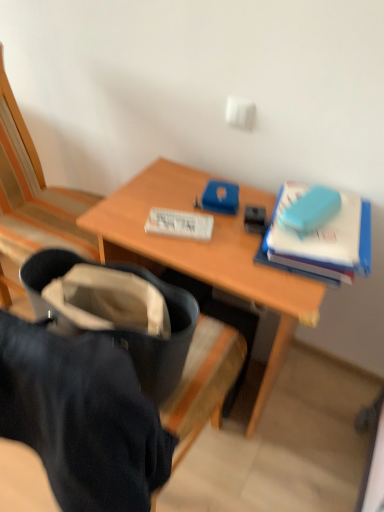
Measure the distance between black fabric bag at center and camera.

black fabric bag at center and camera are 20.09 inches apart from each other.

The height and width of the screenshot is (512, 384). What do you see at coordinates (82, 418) in the screenshot?
I see `black fabric bag at center` at bounding box center [82, 418].

Describe the element at coordinates (180, 224) in the screenshot. This screenshot has width=384, height=512. I see `white paper at center, placed as the first paperback book when sorted from left to right` at that location.

How much space does blue matte book at upper right, arranged as the second paperback book when viewed from the left, occupy vertically?

2.57 inches.

This screenshot has width=384, height=512. What do you see at coordinates (34, 193) in the screenshot?
I see `wooden chair at left` at bounding box center [34, 193].

Locate an element on the screen. black fabric bag at center is located at coordinates (82, 418).

From the image's perspective, which is above, wooden chair at left or black fabric bag at center?

wooden chair at left, from the image's perspective.

Considering the relative sizes of wooden chair at left and black fabric bag at center in the image provided, is wooden chair at left bigger than black fabric bag at center?

Yes, wooden chair at left is bigger than black fabric bag at center.

Who is taller, wooden chair at left or black fabric bag at center?

With more height is wooden chair at left.

Considering the sizes of objects wooden chair at left and black fabric bag at center in the image provided, who is wider, wooden chair at left or black fabric bag at center?

Wider between the two is wooden chair at left.

Is wooden chair at left far away from white paper at center, which appears as the second paperback book when viewed from the right?

No, wooden chair at left is not far from white paper at center, which appears as the second paperback book when viewed from the right.

Is wooden chair at left further to camera compared to white paper at center, which appears as the second paperback book when viewed from the right?

No, wooden chair at left is closer to the viewer.

Who is smaller, wooden chair at left or white paper at center, placed as the first paperback book when sorted from left to right?

white paper at center, placed as the first paperback book when sorted from left to right, is smaller.

Looking at this image, how many degrees apart are the facing directions of wooden chair at left and white paper at center, which appears as the second paperback book when viewed from the right?

There is a 20.1-degree angle between the facing directions of wooden chair at left and white paper at center, which appears as the second paperback book when viewed from the right.

Considering the sizes of white paper at center, which appears as the second paperback book when viewed from the right, and blue matte book at upper right, the 1th paperback book in the right-to-left sequence, in the image, is white paper at center, which appears as the second paperback book when viewed from the right, wider or thinner than blue matte book at upper right, the 1th paperback book in the right-to-left sequence,?

Clearly, white paper at center, which appears as the second paperback book when viewed from the right, has less width compared to blue matte book at upper right, the 1th paperback book in the right-to-left sequence.

This screenshot has height=512, width=384. What are the coordinates of `paperback book above the blue matte book at upper right, arranged as the second paperback book when viewed from the left (from the image's perspective)` in the screenshot? It's located at (180, 224).

From a real-world perspective, between white paper at center, which appears as the second paperback book when viewed from the right, and blue matte book at upper right, arranged as the second paperback book when viewed from the left, who is vertically lower?

From a 3D spatial view, white paper at center, which appears as the second paperback book when viewed from the right, is below.

From the picture: Considering the relative sizes of white paper at center, which appears as the second paperback book when viewed from the right, and black fabric bag at center in the image provided, is white paper at center, which appears as the second paperback book when viewed from the right, wider than black fabric bag at center?

No, white paper at center, which appears as the second paperback book when viewed from the right, is not wider than black fabric bag at center.

Considering the relative positions of white paper at center, which appears as the second paperback book when viewed from the right, and black fabric bag at center in the image provided, is white paper at center, which appears as the second paperback book when viewed from the right, to the left of black fabric bag at center from the viewer's perspective?

No, white paper at center, which appears as the second paperback book when viewed from the right, is not to the left of black fabric bag at center.

Which object is further away from the camera, white paper at center, which appears as the second paperback book when viewed from the right, or black fabric bag at center?

white paper at center, which appears as the second paperback book when viewed from the right, is further away from the camera.

Can you see white paper at center, placed as the first paperback book when sorted from left to right, touching black fabric bag at center?

white paper at center, placed as the first paperback book when sorted from left to right, and black fabric bag at center are not in contact.

Relative to blue matte book at upper right, the 1th paperback book in the right-to-left sequence, is wooden chair at left in front or behind?

In the image, wooden chair at left appears in front of blue matte book at upper right, the 1th paperback book in the right-to-left sequence.

In terms of size, does wooden chair at left appear bigger or smaller than blue matte book at upper right, arranged as the second paperback book when viewed from the left?

Considering their sizes, wooden chair at left takes up more space than blue matte book at upper right, arranged as the second paperback book when viewed from the left.

Considering the positions of objects wooden chair at left and blue matte book at upper right, the 1th paperback book in the right-to-left sequence, in the image provided, who is more to the left, wooden chair at left or blue matte book at upper right, the 1th paperback book in the right-to-left sequence,?

Positioned to the left is wooden chair at left.

Considering the points (8, 89) and (327, 234), which point is in front, point (8, 89) or point (327, 234)?

The point (327, 234) is closer to the camera.

Which object is closer to the camera taking this photo, blue matte book at upper right, the 1th paperback book in the right-to-left sequence, or white paper at center, placed as the first paperback book when sorted from left to right?

blue matte book at upper right, the 1th paperback book in the right-to-left sequence.

Considering the relative sizes of blue matte book at upper right, arranged as the second paperback book when viewed from the left, and white paper at center, placed as the first paperback book when sorted from left to right, in the image provided, is blue matte book at upper right, arranged as the second paperback book when viewed from the left, wider than white paper at center, placed as the first paperback book when sorted from left to right,?

Correct, the width of blue matte book at upper right, arranged as the second paperback book when viewed from the left, exceeds that of white paper at center, placed as the first paperback book when sorted from left to right.

What's the angular difference between blue matte book at upper right, the 1th paperback book in the right-to-left sequence, and white paper at center, which appears as the second paperback book when viewed from the right,'s facing directions?

There is a 99.8-degree angle between the facing directions of blue matte book at upper right, the 1th paperback book in the right-to-left sequence, and white paper at center, which appears as the second paperback book when viewed from the right.

Does blue matte book at upper right, the 1th paperback book in the right-to-left sequence, have a lesser height compared to white paper at center, placed as the first paperback book when sorted from left to right?

In fact, blue matte book at upper right, the 1th paperback book in the right-to-left sequence, may be taller than white paper at center, placed as the first paperback book when sorted from left to right.

Considering the relative positions of blue matte book at upper right, the 1th paperback book in the right-to-left sequence, and black fabric bag at center in the image provided, is blue matte book at upper right, the 1th paperback book in the right-to-left sequence, to the left or to the right of black fabric bag at center?

blue matte book at upper right, the 1th paperback book in the right-to-left sequence, is to the right of black fabric bag at center.

This screenshot has width=384, height=512. What are the coordinates of `clothing that appears below the blue matte book at upper right, the 1th paperback book in the right-to-left sequence (from the image's perspective)` in the screenshot? It's located at (82, 418).

Is blue matte book at upper right, the 1th paperback book in the right-to-left sequence, aimed at black fabric bag at center?

Yes, blue matte book at upper right, the 1th paperback book in the right-to-left sequence, is turned towards black fabric bag at center.

What's the angular difference between blue matte book at upper right, the 1th paperback book in the right-to-left sequence, and black fabric bag at center's facing directions?

173 degrees.

At what (x,y) coordinates should I click in order to perform the action: click on clothing in front of the wooden chair at left. Please return your answer as a coordinate pair (x, y). Looking at the image, I should click on (82, 418).

From a real-world perspective, count 1st paperback books upward from the wooden chair at left and point to it. Please provide its 2D coordinates.

[(180, 224)]

Looking at the image, which one is located further to white paper at center, placed as the first paperback book when sorted from left to right, black fabric bag at center or wooden desk at center?

Among the two, black fabric bag at center is located further to white paper at center, placed as the first paperback book when sorted from left to right.

Estimate the real-world distances between objects in this image. Which object is closer to wooden desk at center, black fabric bag at center or blue matte book at upper right, the 1th paperback book in the right-to-left sequence?

blue matte book at upper right, the 1th paperback book in the right-to-left sequence, is closer to wooden desk at center.

Looking at the image, which one is located closer to black fabric bag at center, wooden chair at left or blue matte book at upper right, arranged as the second paperback book when viewed from the left?

blue matte book at upper right, arranged as the second paperback book when viewed from the left.

Considering their positions, is black fabric bag at center positioned closer to blue matte book at upper right, arranged as the second paperback book when viewed from the left, than white paper at center, placed as the first paperback book when sorted from left to right?

Among the two, white paper at center, placed as the first paperback book when sorted from left to right, is located nearer to blue matte book at upper right, arranged as the second paperback book when viewed from the left.

Estimate the real-world distances between objects in this image. Which object is further from black fabric bag at center, white paper at center, which appears as the second paperback book when viewed from the right, or wooden chair at left?

Among the two, wooden chair at left is located further to black fabric bag at center.

Considering their positions, is black fabric bag at center positioned further to wooden chair at left than wooden desk at center?

black fabric bag at center is further to wooden chair at left.

Considering their positions, is black fabric bag at center positioned further to white paper at center, which appears as the second paperback book when viewed from the right, than blue matte book at upper right, arranged as the second paperback book when viewed from the left?

Based on the image, black fabric bag at center appears to be further to white paper at center, which appears as the second paperback book when viewed from the right.

From the image, which object appears to be farther from wooden desk at center, wooden chair at left or white paper at center, which appears as the second paperback book when viewed from the right?

wooden chair at left.

You are a GUI agent. You are given a task and a screenshot of the screen. Output one action in this format:
    pyautogui.click(x=<x>, y=<y>)
    Task: Click on the desk between wooden chair at left and blue matte book at upper right, arranged as the second paperback book when viewed from the left, in the horizontal direction
    
    Given the screenshot: What is the action you would take?
    pyautogui.click(x=205, y=253)

You are a GUI agent. You are given a task and a screenshot of the screen. Output one action in this format:
    pyautogui.click(x=<x>, y=<y>)
    Task: Click on the paperback book between black fabric bag at center and white paper at center, placed as the first paperback book when sorted from left to right, in the front-back direction
    The height and width of the screenshot is (512, 384).
    Given the screenshot: What is the action you would take?
    pyautogui.click(x=321, y=236)

You are a GUI agent. You are given a task and a screenshot of the screen. Output one action in this format:
    pyautogui.click(x=<x>, y=<y>)
    Task: Click on the desk between black fabric bag at center and white paper at center, placed as the first paperback book when sorted from left to right, along the z-axis
    The width and height of the screenshot is (384, 512).
    Given the screenshot: What is the action you would take?
    pyautogui.click(x=205, y=253)

Image resolution: width=384 pixels, height=512 pixels. In order to click on desk between black fabric bag at center and blue matte book at upper right, arranged as the second paperback book when viewed from the left, in the front-back direction in this screenshot , I will do `click(205, 253)`.